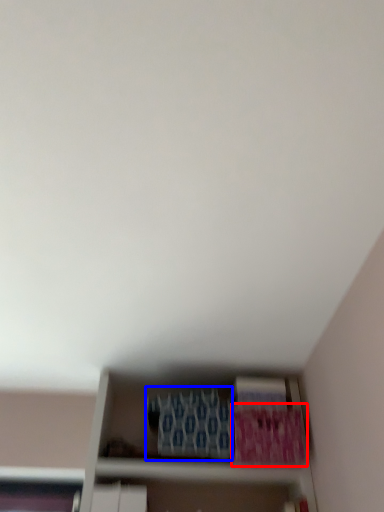
Question: Among these objects, which one is nearest to the camera, paperback book (highlighted by a red box) or paperback book (highlighted by a blue box)?

Choices:
 (A) paperback book
 (B) paperback book

Answer: (B)